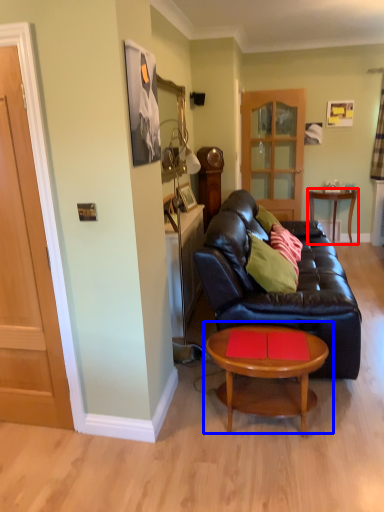
Question: Which of the following is the closest to the observer, table (highlighted by a red box) or coffee table (highlighted by a blue box)?

Choices:
 (A) table
 (B) coffee table

Answer: (B)